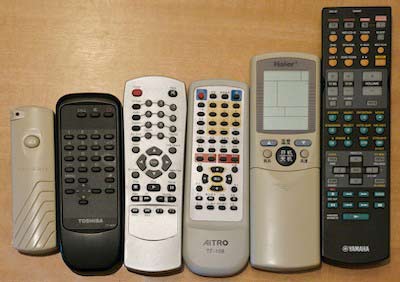
Identify the location of remotes. (360, 163), (132, 167).